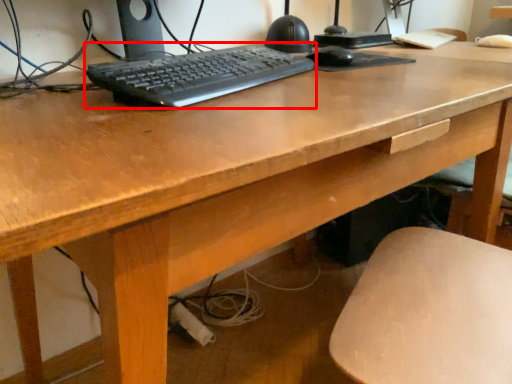
Question: From the image's perspective, where is computer keyboard (annotated by the red box) located relative to mouse?

Choices:
 (A) above
 (B) below

Answer: (B)